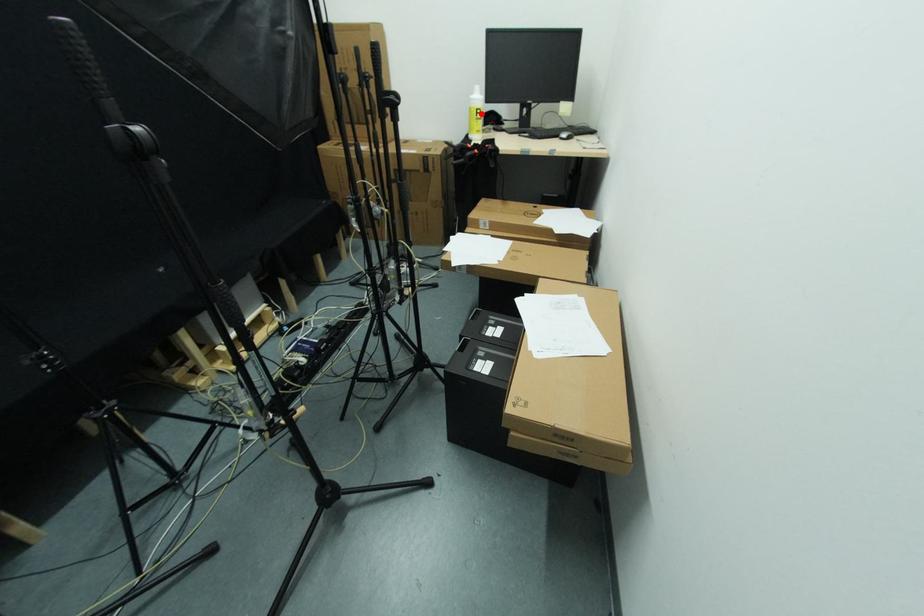
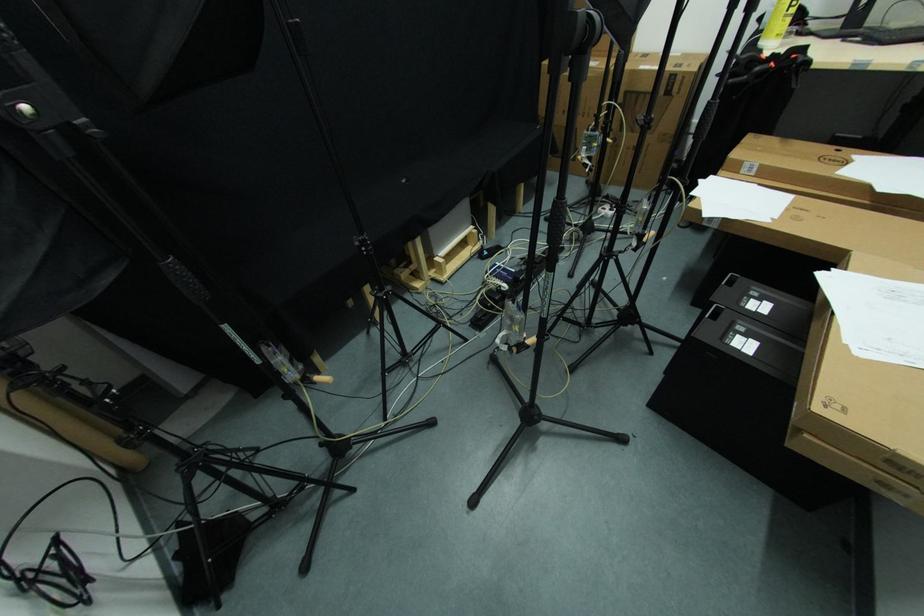
Question: I am providing you with two images of the same scene from different viewpoints. A red point is shown in image1. For the corresponding object point in image2, is it positioned nearer or farther from the camera?

Choices:
 (A) Nearer
 (B) Farther

Answer: (B)